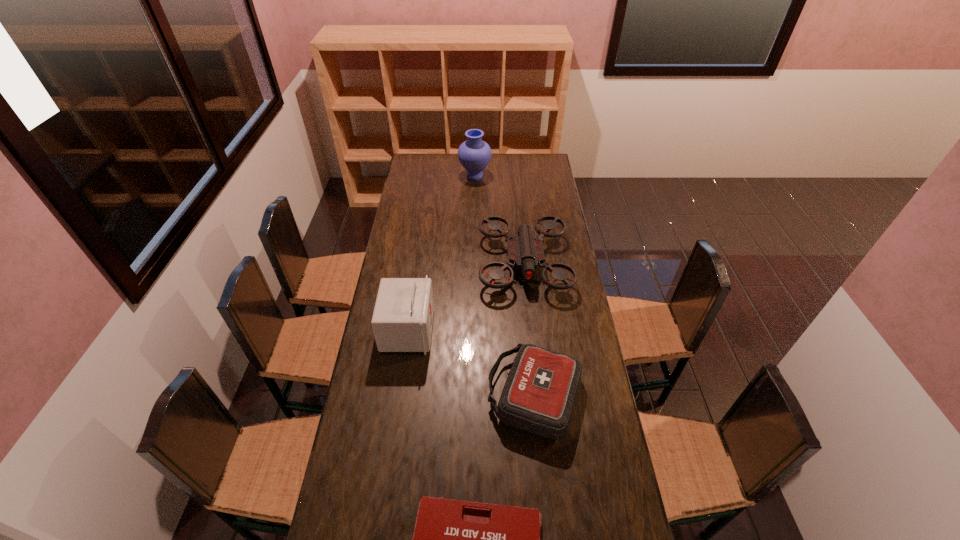
At what (x,y) coordinates should I click in order to perform the action: click on the tallest object. Please return your answer as a coordinate pair (x, y). Looking at the image, I should click on (474, 154).

Locate an element on the screen. The height and width of the screenshot is (540, 960). vase is located at coordinates (474, 154).

Locate an element on the screen. Image resolution: width=960 pixels, height=540 pixels. the tallest first-aid kit is located at coordinates point(402,321).

The width and height of the screenshot is (960, 540). I want to click on the second farthest object, so click(x=525, y=251).

At what (x,y) coordinates should I click in order to perform the action: click on drone. Please return your answer as a coordinate pair (x, y). This screenshot has height=540, width=960. Looking at the image, I should click on (525, 251).

You are a GUI agent. You are given a task and a screenshot of the screen. Output one action in this format:
    pyautogui.click(x=<x>, y=<y>)
    Task: Click on the second tallest first-aid kit
    The image size is (960, 540).
    Given the screenshot: What is the action you would take?
    539,394

Locate an element on the screen. Image resolution: width=960 pixels, height=540 pixels. vacant space located on the left of the tallest object is located at coordinates (435, 176).

The height and width of the screenshot is (540, 960). Identify the location of free region located on the front-facing side of the fourth shortest object. (500, 330).

Find the location of a particular element. The height and width of the screenshot is (540, 960). vacant space located 0.100m on the front-facing side of the third tallest object is located at coordinates (530, 321).

I want to click on vacant space located on the left of the second shortest object, so click(x=428, y=394).